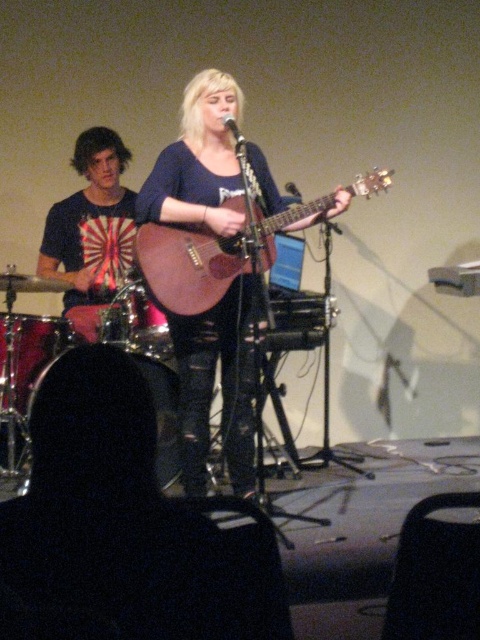
Question: Can you confirm if brushed metal drumsticks at left is positioned above brushed metal drum at lower left?

Choices:
 (A) yes
 (B) no

Answer: (A)

Question: From the image, what is the correct spatial relationship of brushed metal drum at left in relation to brushed metal drum at lower left?

Choices:
 (A) left
 (B) right

Answer: (A)

Question: Estimate the real-world distances between objects in this image. Which object is closer to the wooden acoustic guitar at center?

Choices:
 (A) matte brown guitar at center
 (B) metallic silver microphone at upper center

Answer: (A)

Question: Does matte brown guitar at center appear under brushed metal drumsticks at left?

Choices:
 (A) no
 (B) yes

Answer: (B)

Question: Which object is positioned farthest from the wooden acoustic guitar at center?

Choices:
 (A) brushed metal drumsticks at left
 (B) matte brown guitar at center

Answer: (A)

Question: Which of these objects is positioned closest to the brushed metal drum at left?

Choices:
 (A) brushed metal drum at lower left
 (B) brushed metal drumsticks at left
 (C) metallic silver microphone at upper center
 (D) shiny silver drum at lower left

Answer: (A)